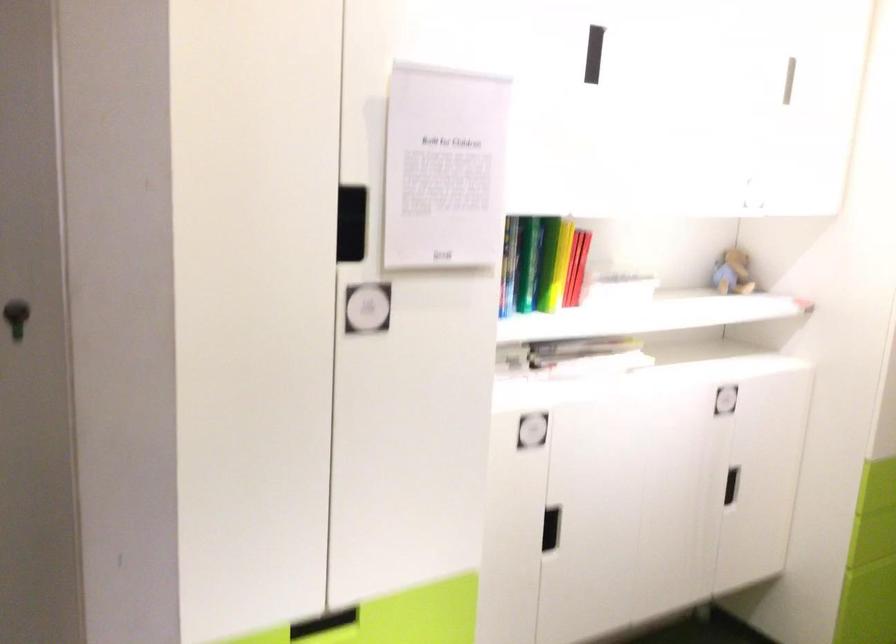
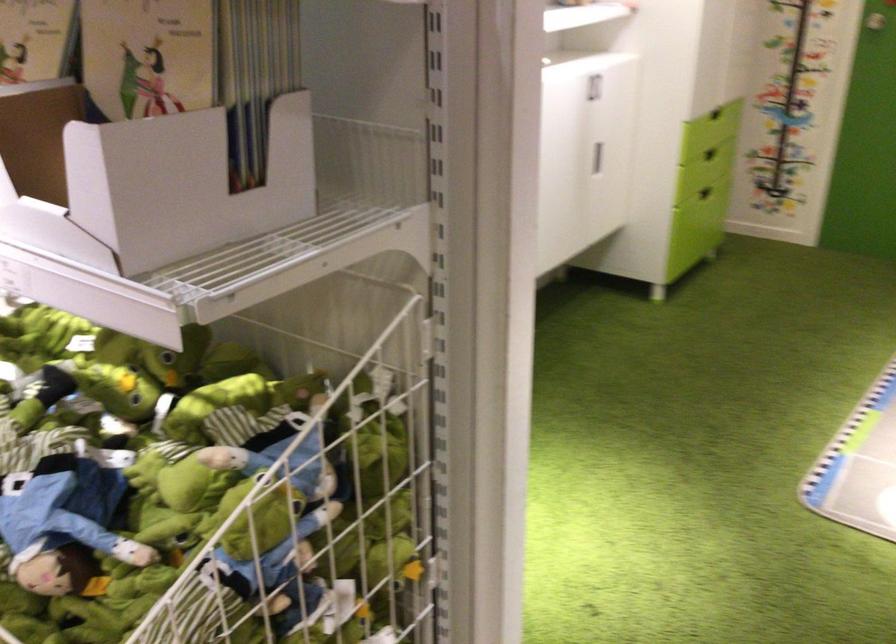
Question: I am providing you with two images of the same scene from different viewpoints. After the viewpoint changes to image2, which objects are now occluded?

Choices:
 (A) red rose object
 (B) green drawer handle
 (C) stuffed frog toy
 (D) black cabinet handle

Answer: (D)